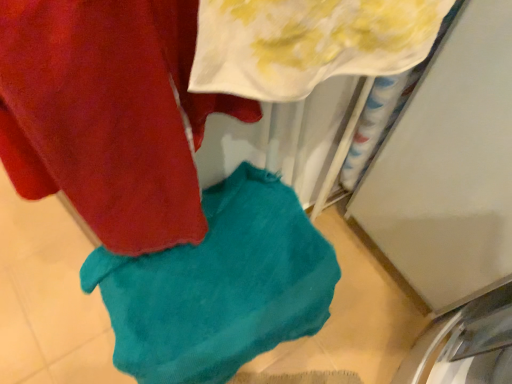
What do you see at coordinates (219, 286) in the screenshot? I see `teal soft towel at center` at bounding box center [219, 286].

Locate an element on the screen. The image size is (512, 384). teal soft towel at center is located at coordinates (219, 286).

Where is `teal soft towel at center`? This screenshot has width=512, height=384. teal soft towel at center is located at coordinates (219, 286).